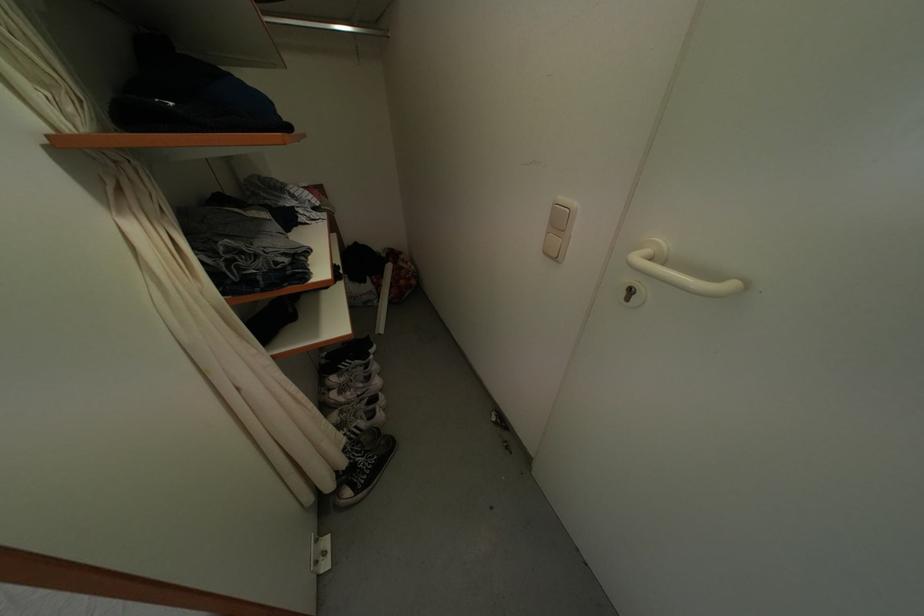
Image resolution: width=924 pixels, height=616 pixels. I want to click on door keyhole, so click(x=631, y=294).